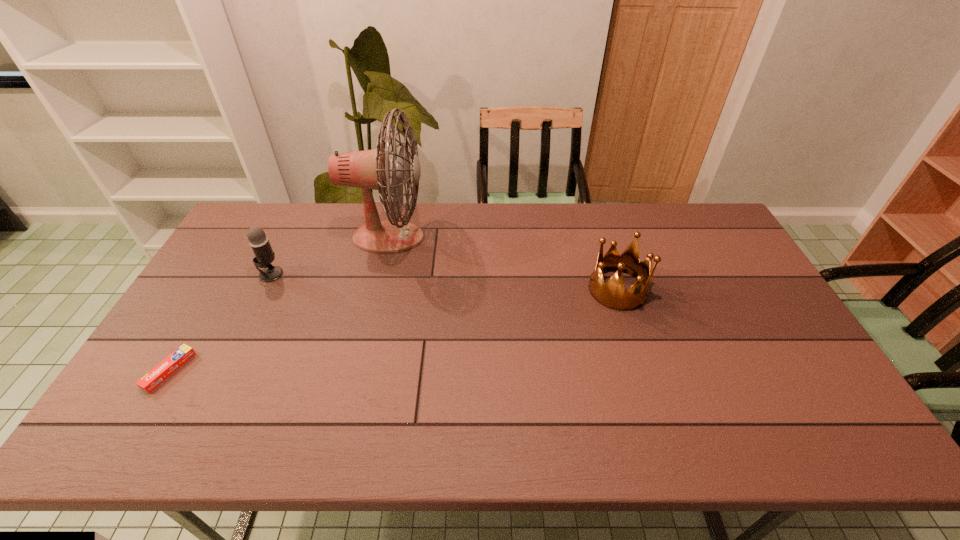
Find the location of a particular element. The image size is (960, 540). unoccupied area between the crown and the third object from right to left is located at coordinates (444, 282).

Where is `empty space that is in between the rightmost object and the second object from left to right`? Image resolution: width=960 pixels, height=540 pixels. empty space that is in between the rightmost object and the second object from left to right is located at coordinates (444, 282).

This screenshot has width=960, height=540. In order to click on vacant area that lies between the crown and the toothpaste in this screenshot , I will do `click(394, 330)`.

Find the location of a particular element. Image resolution: width=960 pixels, height=540 pixels. vacant area that lies between the shortest object and the second object from left to right is located at coordinates (220, 322).

The width and height of the screenshot is (960, 540). In order to click on vacant point located between the third object from right to left and the leftmost object in this screenshot , I will do `click(220, 322)`.

Find the location of a particular element. This screenshot has height=540, width=960. free space that is in between the tallest object and the second object from left to right is located at coordinates (329, 256).

Locate an element on the screen. free space between the microphone and the rightmost object is located at coordinates click(x=444, y=282).

The image size is (960, 540). Identify the location of empty space that is in between the leftmost object and the microphone. (220, 322).

Identify the location of free spot between the crown and the nearest object. (394, 330).

Locate which object ranks in proximity to the rightmost object. Please provide its 2D coordinates. Your answer should be formatted as a tuple, i.e. [(x, y)], where the tuple contains the x and y coordinates of a point satisfying the conditions above.

[(370, 169)]